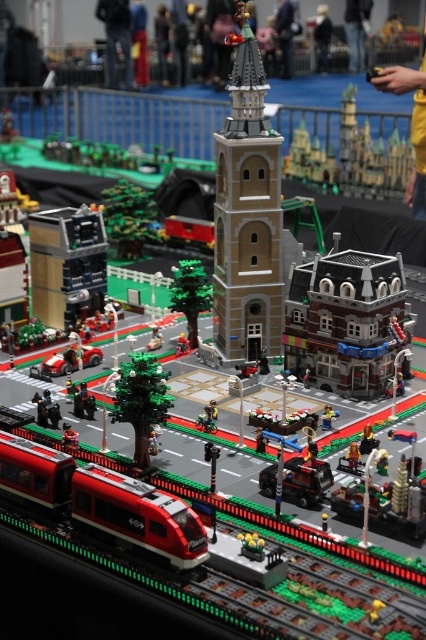
You are a visitor standing in front of the Lego town scene. You notice the light brown brick tower at center and the shiny red train at lower left. Which object is positioned higher in the image?

The light brown brick tower at center is positioned higher than the shiny red train at lower left according to the description.

You are a Lego train engineer planning to navigate your train through the smooth plastic train track at center. Considering the height of the light brown brick tower at center, will your train be able to pass under it without any issues?

The smooth plastic train track at center is shorter than the light brown brick tower at center, so the train should be able to pass under it without any issues.